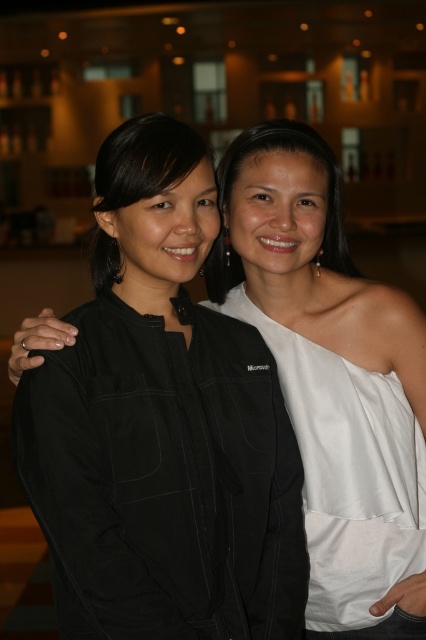
Question: Which object is farther from the camera taking this photo?

Choices:
 (A) white satin dress at center
 (B) matte black jacket at left
 (C) matte white dress at center

Answer: (C)

Question: Considering the relative positions of white satin dress at center and matte white dress at center in the image provided, where is white satin dress at center located with respect to matte white dress at center?

Choices:
 (A) right
 (B) left

Answer: (A)

Question: Observing the image, what is the correct spatial positioning of matte black jacket at left in reference to matte white dress at center?

Choices:
 (A) left
 (B) right

Answer: (A)

Question: Which of the following is the closest to the observer?

Choices:
 (A) (227, 196)
 (B) (98, 202)

Answer: (B)

Question: From the image, what is the correct spatial relationship of white satin dress at center in relation to matte white dress at center?

Choices:
 (A) right
 (B) left

Answer: (A)

Question: Which of the following is the closest to the observer?

Choices:
 (A) (281, 140)
 (B) (172, 172)

Answer: (B)